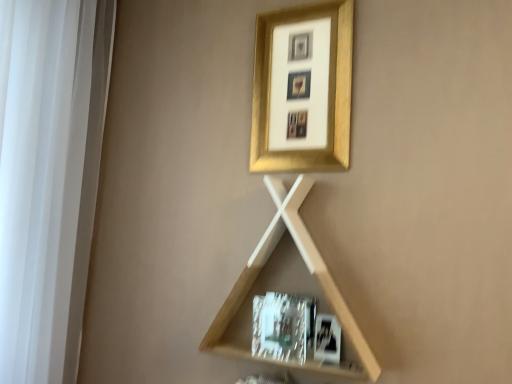
Question: From a real-world perspective, is white fabric at left positioned above or below metallic silver picture frame at lower right, the second picture frame in the back-to-front sequence?

Choices:
 (A) above
 (B) below

Answer: (A)

Question: Visually, is white fabric at left positioned to the left or to the right of metallic silver picture frame at lower right, which is the first picture frame from bottom to top?

Choices:
 (A) left
 (B) right

Answer: (A)

Question: Estimate the real-world distances between objects in this image. Which object is farther from the white fabric at left?

Choices:
 (A) metallic silver picture frame at lower right, the 1th picture frame when ordered from front to back
 (B) light wood/texture shelf at center
 (C) gold metallic picture frame at upper center, the 2th picture frame in the bottom-to-top sequence

Answer: (A)

Question: Estimate the real-world distances between objects in this image. Which object is closer to the white fabric at left?

Choices:
 (A) light wood/texture shelf at center
 (B) gold metallic picture frame at upper center, the 2th picture frame in the bottom-to-top sequence
 (C) metallic silver picture frame at lower right, which is the first picture frame from bottom to top

Answer: (A)